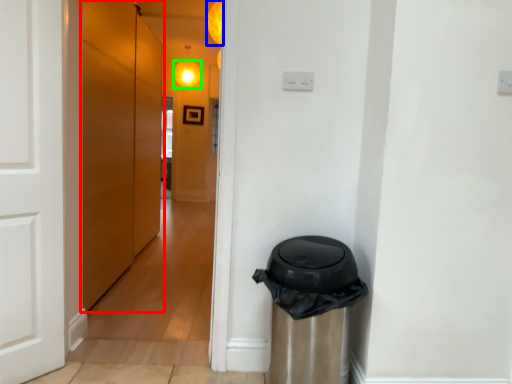
Question: Which object is positioned farthest from door (highlighted by a red box)? Select from light (highlighted by a blue box) and light (highlighted by a green box).

Choices:
 (A) light
 (B) light

Answer: (B)